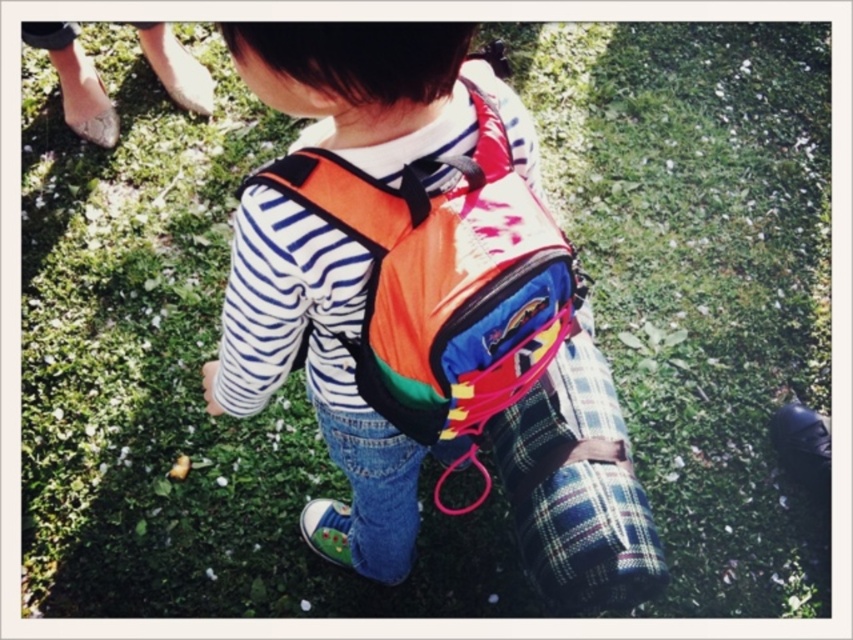
Question: Can you confirm if matte orange backpack at center is wider than plaid fabric at center?

Choices:
 (A) no
 (B) yes

Answer: (B)

Question: Which of the following is the closest to the observer?

Choices:
 (A) plaid fabric at center
 (B) matte orange backpack at center

Answer: (B)

Question: Among these points, which one is farthest from the camera?

Choices:
 (A) (593, 528)
 (B) (442, 349)

Answer: (A)

Question: Is matte orange backpack at center to the left of plaid fabric at center from the viewer's perspective?

Choices:
 (A) no
 (B) yes

Answer: (B)

Question: Does matte orange backpack at center have a lesser width compared to plaid fabric at center?

Choices:
 (A) yes
 (B) no

Answer: (B)